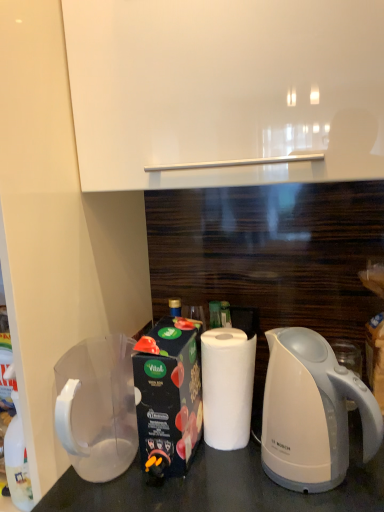
Question: From a real-world perspective, is white matte paper towel at center located beneath white glossy electric kettle at lower right?

Choices:
 (A) yes
 (B) no

Answer: (A)

Question: Considering the relative sizes of white matte paper towel at center and white glossy electric kettle at lower right in the image provided, is white matte paper towel at center wider than white glossy electric kettle at lower right?

Choices:
 (A) yes
 (B) no

Answer: (B)

Question: Does white matte paper towel at center have a greater height compared to white glossy electric kettle at lower right?

Choices:
 (A) no
 (B) yes

Answer: (A)

Question: Does white matte paper towel at center have a larger size compared to white glossy electric kettle at lower right?

Choices:
 (A) no
 (B) yes

Answer: (A)

Question: Could you tell me if white matte paper towel at center is turned towards white glossy electric kettle at lower right?

Choices:
 (A) yes
 (B) no

Answer: (B)

Question: Is white matte paper towel at center inside the boundaries of white glossy electric kettle at lower right, or outside?

Choices:
 (A) inside
 (B) outside

Answer: (B)

Question: From the image's perspective, relative to white glossy electric kettle at lower right, is white matte paper towel at center above or below?

Choices:
 (A) above
 (B) below

Answer: (A)

Question: In the image, is white matte paper towel at center on the left side or the right side of white glossy electric kettle at lower right?

Choices:
 (A) right
 (B) left

Answer: (B)

Question: Is white matte paper towel at center in front of or behind white glossy electric kettle at lower right in the image?

Choices:
 (A) front
 (B) behind

Answer: (B)

Question: Considering their positions, is transparent plastic pitcher at lower left located in front of or behind white matte paper towel at center?

Choices:
 (A) front
 (B) behind

Answer: (A)

Question: From the image's perspective, is transparent plastic pitcher at lower left positioned above or below white matte paper towel at center?

Choices:
 (A) below
 (B) above

Answer: (A)

Question: In the image, is transparent plastic pitcher at lower left on the left side or the right side of white matte paper towel at center?

Choices:
 (A) left
 (B) right

Answer: (A)

Question: Is transparent plastic pitcher at lower left spatially inside white matte paper towel at center, or outside of it?

Choices:
 (A) inside
 (B) outside

Answer: (B)

Question: From a real-world perspective, is white matte paper towel at center above or below transparent plastic pitcher at lower left?

Choices:
 (A) below
 (B) above

Answer: (B)

Question: In the image, is white matte paper towel at center positioned in front of or behind transparent plastic pitcher at lower left?

Choices:
 (A) behind
 (B) front

Answer: (A)